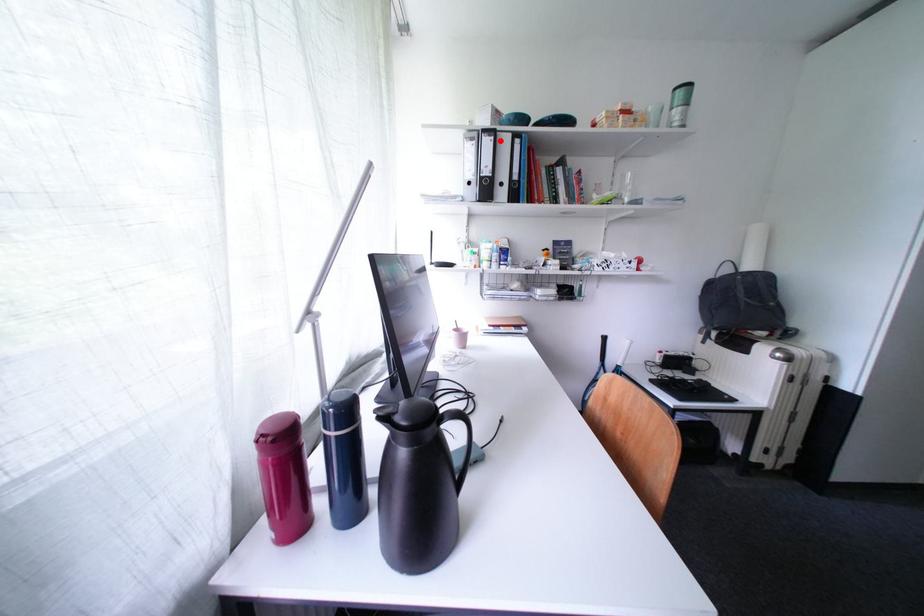
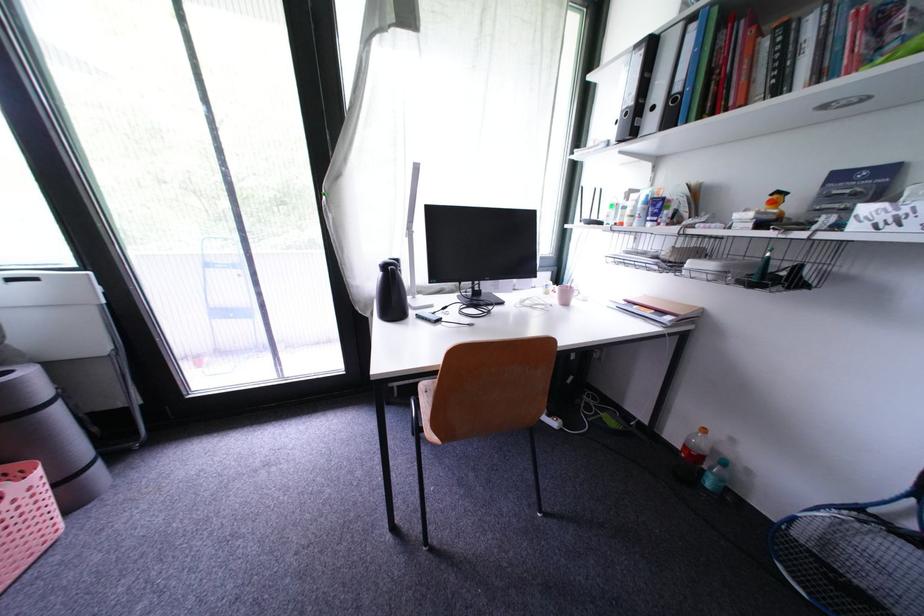
Question: I am providing you with two images of the same scene from different viewpoints. A red point is marked on the first image. Can you still see the location of the red point in image 2?

Choices:
 (A) Yes
 (B) No

Answer: (A)